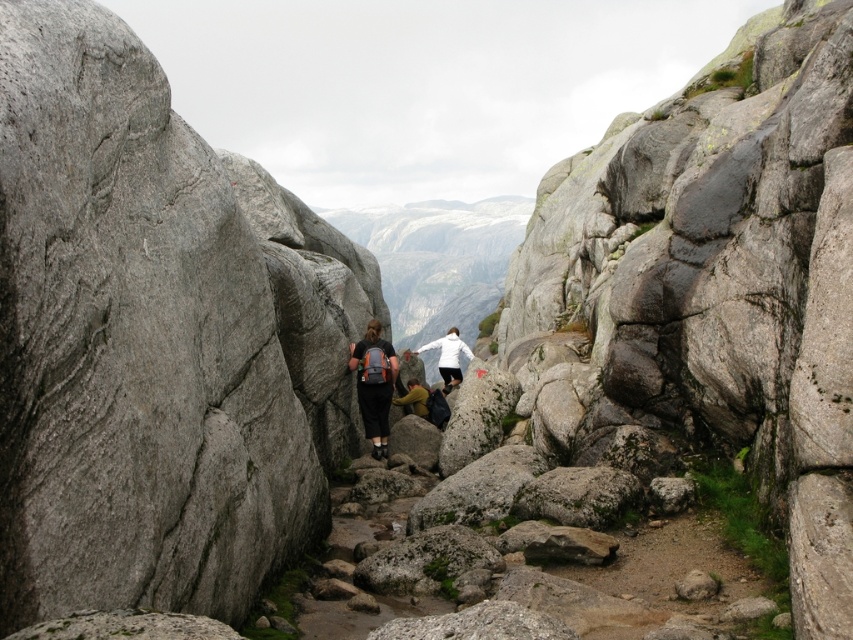
Who is more distant from viewer, (451, 332) or (695, 579)?

The point (451, 332) is behind.

Which is above, white matte jacket at center or gray rough rock at center?

white matte jacket at center

Describe the element at coordinates (445, 356) in the screenshot. I see `white matte jacket at center` at that location.

Where is `white matte jacket at center`? The width and height of the screenshot is (853, 640). white matte jacket at center is located at coordinates (445, 356).

Between gray rock formation at center and matte black backpack at center, which one is positioned lower?

matte black backpack at center

Can you confirm if gray rock formation at center is wider than matte black backpack at center?

Yes.

Measure the distance between point (415, 211) and camera.

The distance of point (415, 211) from camera is 1717.54 feet.

Where is `gray rock formation at center`? gray rock formation at center is located at coordinates (438, 259).

Is gray rock formation at center in front of gray rough rock at center?

That is False.

Between point (473, 204) and point (683, 580), which one is positioned in front?

Point (683, 580)

In order to click on gray rock formation at center in this screenshot , I will do `click(438, 259)`.

Where is `gray rock formation at center`? The height and width of the screenshot is (640, 853). gray rock formation at center is located at coordinates (438, 259).